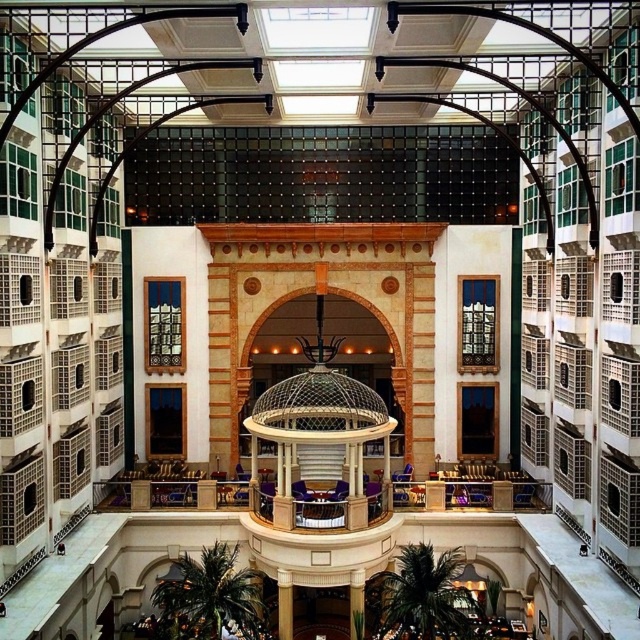
You are standing at the entrance of the atrium and want to find the golden polished column at center. According to the coordinates provided, in which direction should you walk to reach it?

The golden polished column at center is located at coordinates point (284,604). Since the x coordinate is 0.944, which is closer to the right edge of the image, and the y coordinate is 0.445, which is halfway up the image, you should walk towards the right and slightly forward to reach it.

You are a maintenance worker needing to inspect both the golden polished column at center and the green marble pillar at center. If your ladder can only extend to 4 meters, can you safely reach both columns from one position without moving the ladder?

The golden polished column at center is 4.83 meters away from the green marble pillar at center. Since the ladder can only extend to 4 meters, you cannot safely reach both columns from one position without moving the ladder because the distance between them exceeds the ladder length.

You are an interior designer planning to place a large sculpture between the golden polished column at center and the green marble pillar at center. Given their widths, which column should the sculpture be placed closer to ensure stability?

The golden polished column at center has a smaller width than the green marble pillar at center. To ensure stability, the sculpture should be placed closer to the green marble pillar at center since it is wider and can provide a more stable base.